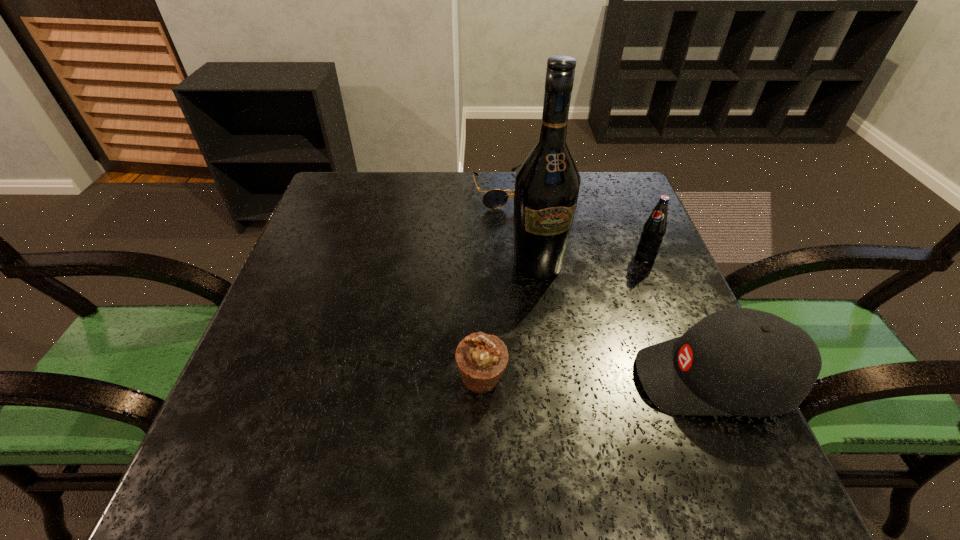
Locate an element on the screen. The width and height of the screenshot is (960, 540). vacant space at the near left corner is located at coordinates (271, 430).

In the image, there is a desktop. Where is `vacant space at the far right corner`? The height and width of the screenshot is (540, 960). vacant space at the far right corner is located at coordinates (631, 189).

Image resolution: width=960 pixels, height=540 pixels. I want to click on free space between the baseball cap and the pop, so click(680, 318).

This screenshot has width=960, height=540. I want to click on unoccupied position between the tallest object and the baseball cap, so click(x=626, y=322).

The image size is (960, 540). In order to click on free space between the wine bottle and the baseball cap in this screenshot , I will do `click(626, 322)`.

The height and width of the screenshot is (540, 960). Identify the location of blank region between the pop and the baseball cap. (680, 318).

This screenshot has width=960, height=540. What are the coordinates of `vacant area between the muffin and the baseball cap` in the screenshot? It's located at (598, 379).

Locate an element on the screen. vacant area between the muffin and the tallest object is located at coordinates (510, 321).

Where is `free space between the pop and the muffin`? The height and width of the screenshot is (540, 960). free space between the pop and the muffin is located at coordinates (564, 318).

Where is `vacant region between the muffin and the pop`? This screenshot has height=540, width=960. vacant region between the muffin and the pop is located at coordinates (564, 318).